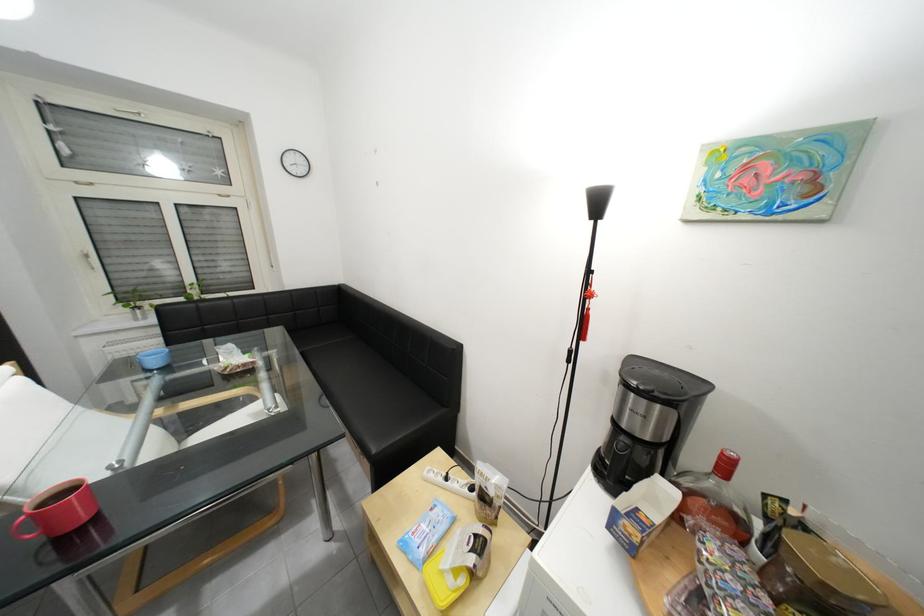
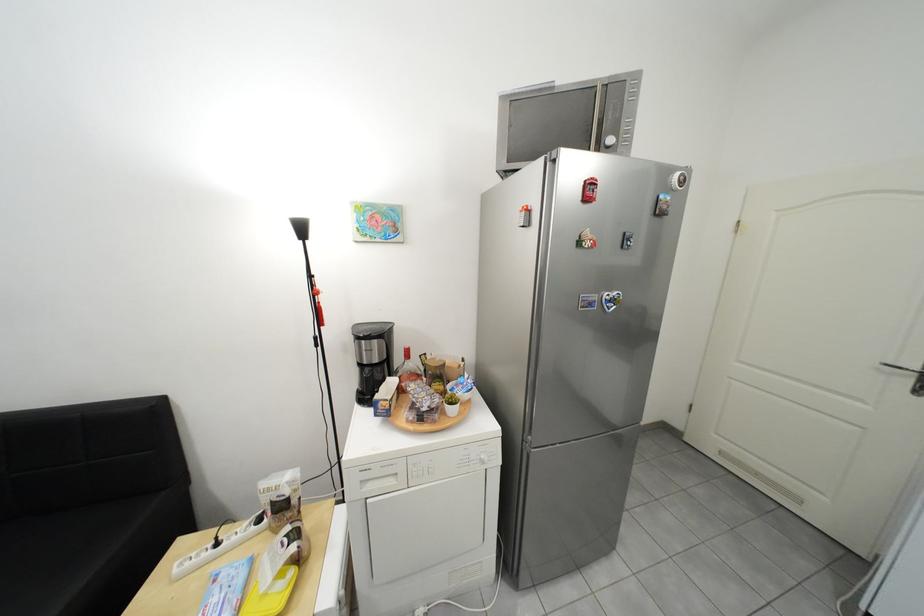
Question: The images are taken continuously from a first-person perspective. In which direction is your viewpoint rotating?

Choices:
 (A) Left
 (B) Right
 (C) Up
 (D) Down

Answer: (B)